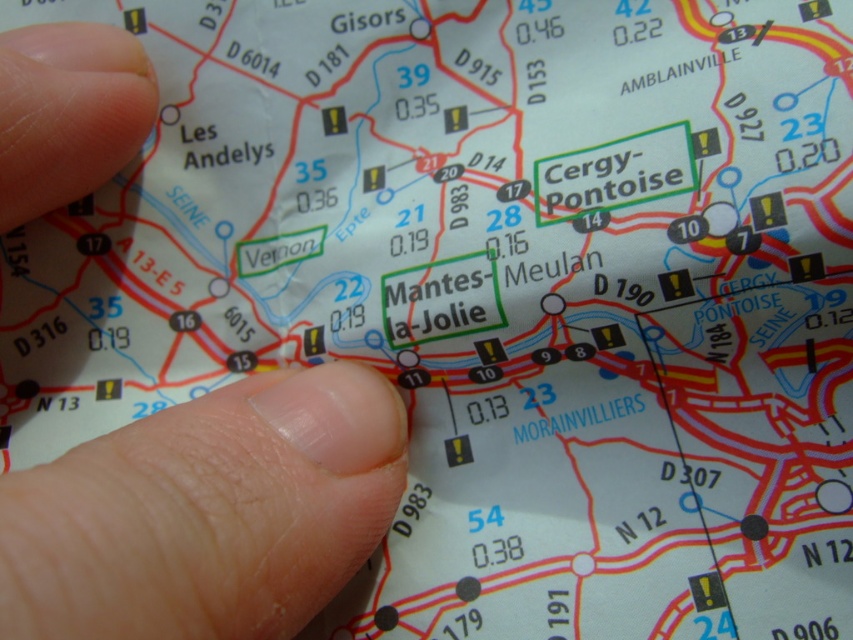
Does pale skin finger at lower left have a smaller size compared to flesh-toned skin at upper left?

Actually, pale skin finger at lower left might be larger than flesh-toned skin at upper left.

Can you confirm if pale skin finger at lower left is taller than flesh-toned skin at upper left?

Yes.

Locate an element on the screen. The height and width of the screenshot is (640, 853). pale skin finger at lower left is located at coordinates (207, 513).

Measure the distance from finger at left to flesh-toned skin at upper left.

finger at left is 12.13 inches from flesh-toned skin at upper left.

Does finger at left appear over flesh-toned skin at upper left?

Actually, finger at left is below flesh-toned skin at upper left.

Which is behind, point (67, 477) or point (126, 74)?

The point (126, 74) is behind.

At what (x,y) coordinates should I click in order to perform the action: click on finger at left. Please return your answer as a coordinate pair (x, y). This screenshot has width=853, height=640. Looking at the image, I should click on (207, 513).

Does point (96, 161) lie behind point (36, 518)?

Yes, point (96, 161) is behind point (36, 518).

Does finger at left come in front of pale skin finger at lower left?

No, it is not.

Who is more distant from viewer, [180,513] or [219,595]?

The point [219,595] is behind.

You are a GUI agent. You are given a task and a screenshot of the screen. Output one action in this format:
    pyautogui.click(x=<x>, y=<y>)
    Task: Click on the finger at left
    The height and width of the screenshot is (640, 853).
    Given the screenshot: What is the action you would take?
    pyautogui.click(x=207, y=513)